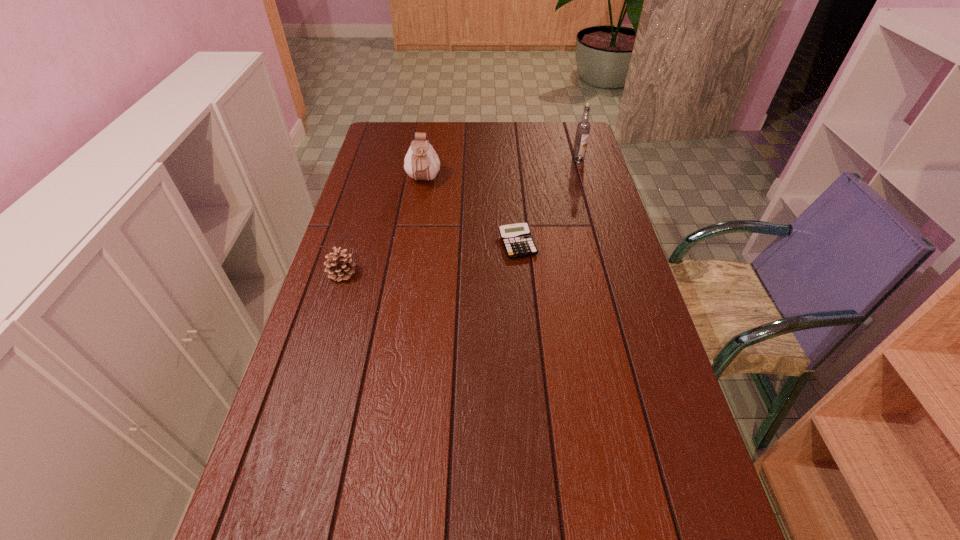
Locate an element on the screen. This screenshot has width=960, height=540. empty space that is in between the second nearest object and the farthest object is located at coordinates (548, 202).

Locate an element on the screen. This screenshot has width=960, height=540. unoccupied area between the third object from right to left and the calculator is located at coordinates (470, 213).

The width and height of the screenshot is (960, 540). Find the location of `free space that is in between the shortest object and the leftmost object`. free space that is in between the shortest object and the leftmost object is located at coordinates (430, 259).

Identify the location of vacant area that lies between the farthest object and the shortest object. (548, 202).

The height and width of the screenshot is (540, 960). I want to click on free space between the third object from left to right and the vodka, so click(x=548, y=202).

I want to click on free spot between the second tallest object and the vodka, so click(500, 171).

Where is `free space between the farthest object and the pinecone`? free space between the farthest object and the pinecone is located at coordinates (460, 217).

Find the location of `object that is the second closest to the third object from left to right`. object that is the second closest to the third object from left to right is located at coordinates (339, 265).

Identify which object is the closest to the third shortest object. Please provide its 2D coordinates. Your answer should be formatted as a tuple, i.e. [(x, y)], where the tuple contains the x and y coordinates of a point satisfying the conditions above.

[(517, 241)]

Image resolution: width=960 pixels, height=540 pixels. I want to click on free spot that satisfies the following two spatial constraints: 1. on the front-facing side of the second object from left to right; 2. on the right side of the shortest object, so [x=414, y=244].